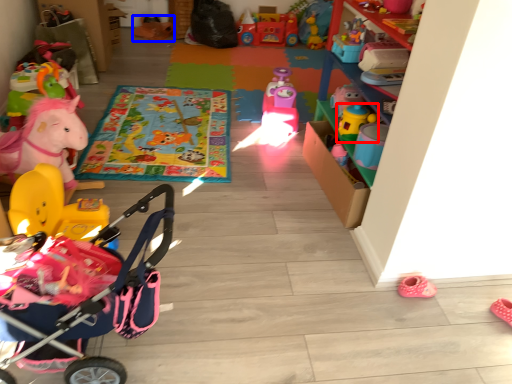
Question: Which of the following is the farthest to the observer, toy (highlighted by a red box) or toy (highlighted by a blue box)?

Choices:
 (A) toy
 (B) toy

Answer: (B)